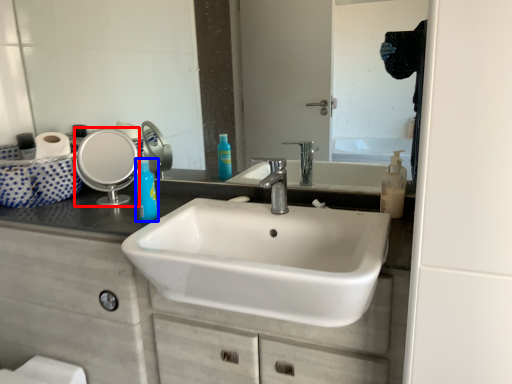
Question: Which of the following is the closest to the observer, mirror (highlighted by a red box) or mouthwash (highlighted by a blue box)?

Choices:
 (A) mirror
 (B) mouthwash

Answer: (B)